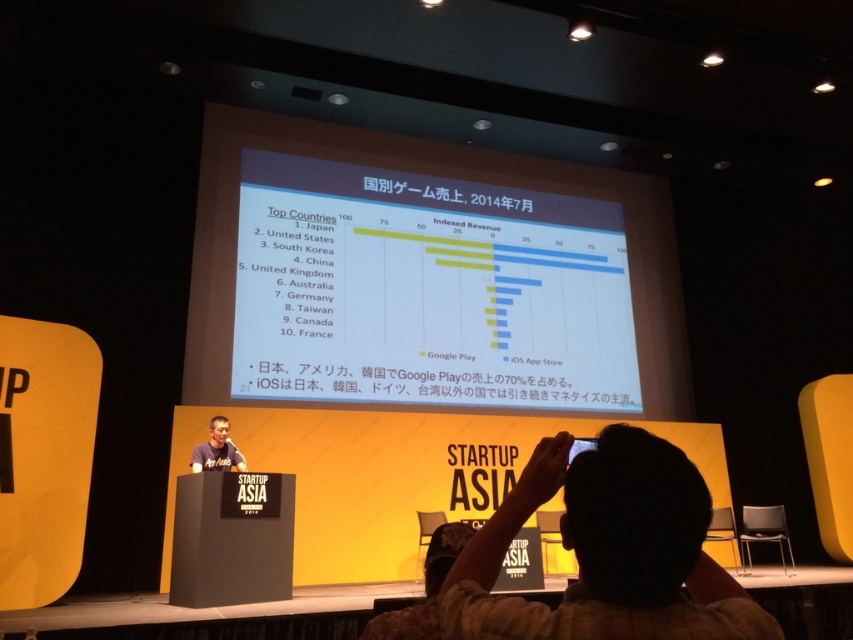
You are sitting in the audience at the Startup Asia 2014 conference. You see two points on the stage. The first point is at coordinates point (471, 579), and the second is at point (192, 465). Which point is closer to you?

The point at coordinates point (471, 579) is closer to you because it is closer to the viewer than point (192, 465).

Looking at this image, you are an attendee at the Startup Asia 2014 conference and want to take a photo of the presentation. Since the matte white chart at center and the matte black shirt at center are both in the center, which one will appear wider in your photo?

The matte white chart at center will appear wider in the photo because its width surpasses that of the matte black shirt at center.

You are an attendee at the Startup Asia 2014 conference. You notice the matte white chart at center and the matte black shirt at center on the stage. From your seat in the audience, which object is positioned higher relative to the other?

The matte white chart at center is located above the matte black shirt at center, so it is positioned higher.